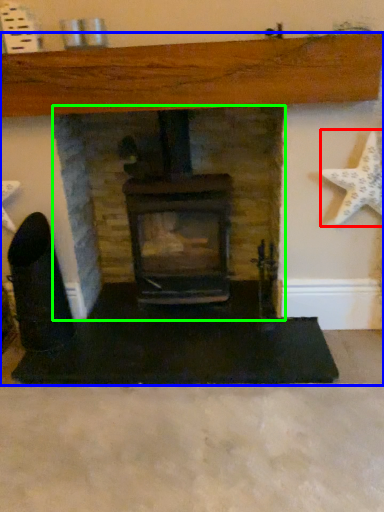
Question: Based on their relative distances, which object is nearer to starfish (highlighted by a red box)? Choose from fireplace (highlighted by a blue box) and fireplace (highlighted by a green box).

Choices:
 (A) fireplace
 (B) fireplace

Answer: (A)